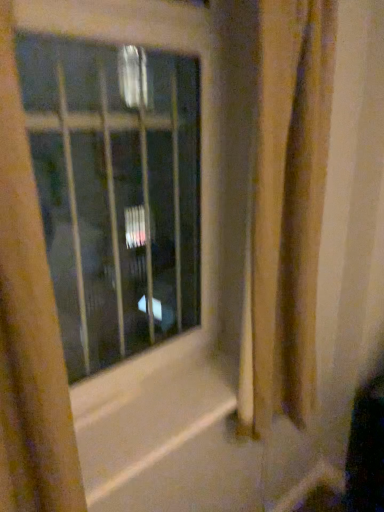
Question: Considering the positions of yellow textured curtain at left and brown textured shower curtain at right in the image, is yellow textured curtain at left taller or shorter than brown textured shower curtain at right?

Choices:
 (A) tall
 (B) short

Answer: (B)

Question: Is yellow textured curtain at left spatially inside brown textured shower curtain at right, or outside of it?

Choices:
 (A) outside
 (B) inside

Answer: (A)

Question: Which object is the farthest from the yellow textured curtain at left?

Choices:
 (A) brown textured shower curtain at right
 (B) transparent glass window at center

Answer: (B)

Question: Which object is the farthest from the yellow textured curtain at left?

Choices:
 (A) brown textured shower curtain at right
 (B) transparent glass window at center

Answer: (B)